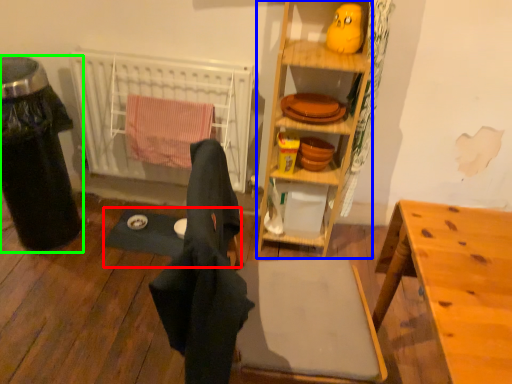
Question: Considering the real-world distances, which object is closest to yoga mat (highlighted by a red box)? cabinetry (highlighted by a blue box) or trash bin/can (highlighted by a green box).

Choices:
 (A) cabinetry
 (B) trash bin/can

Answer: (B)